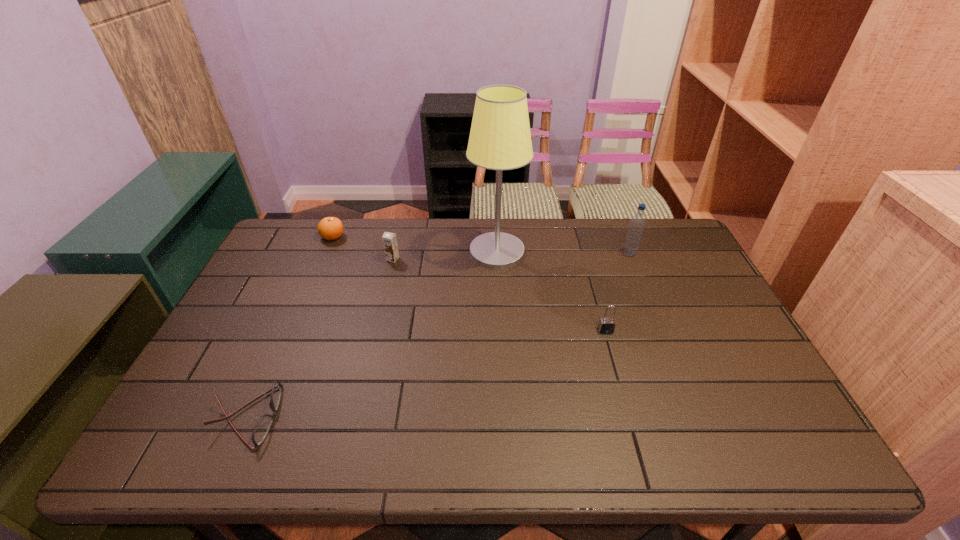
The width and height of the screenshot is (960, 540). I want to click on free point at the near right corner, so click(750, 441).

Find the location of a particular element. The image size is (960, 540). vacant area between the fifth shortest object and the shortest object is located at coordinates (438, 335).

Where is `empty location between the fourth object from left to right and the shortest object`? empty location between the fourth object from left to right and the shortest object is located at coordinates (372, 334).

You are a GUI agent. You are given a task and a screenshot of the screen. Output one action in this format:
    pyautogui.click(x=<x>, y=<y>)
    Task: Click on the vacant point located between the fourth object from right to left and the nearest object
    This screenshot has width=960, height=540.
    Given the screenshot: What is the action you would take?
    pyautogui.click(x=320, y=338)

Where is `blank region between the third object from left to right and the clementine`? The height and width of the screenshot is (540, 960). blank region between the third object from left to right and the clementine is located at coordinates (363, 248).

Where is `empty location between the fifth farthest object and the table lamp`? The image size is (960, 540). empty location between the fifth farthest object and the table lamp is located at coordinates (551, 291).

You are a GUI agent. You are given a task and a screenshot of the screen. Output one action in this format:
    pyautogui.click(x=<x>, y=<y>)
    Task: Click on the free space between the chocolate milk and the padlock
    Image resolution: width=960 pixels, height=540 pixels.
    Given the screenshot: What is the action you would take?
    pyautogui.click(x=499, y=295)

Identify the location of empty location between the fifth farthest object and the third object from right to left. This screenshot has width=960, height=540. (551, 291).

You are a GUI agent. You are given a task and a screenshot of the screen. Output one action in this format:
    pyautogui.click(x=<x>, y=<y>)
    Task: Click on the free space between the fourth object from left to right and the second nearest object
    This screenshot has height=540, width=960.
    Given the screenshot: What is the action you would take?
    pyautogui.click(x=551, y=291)

Select which object appears as the closest to the fifth tallest object. Please provide its 2D coordinates. Your answer should be formatted as a tuple, i.e. [(x, y)], where the tuple contains the x and y coordinates of a point satisfying the conditions above.

[(389, 239)]